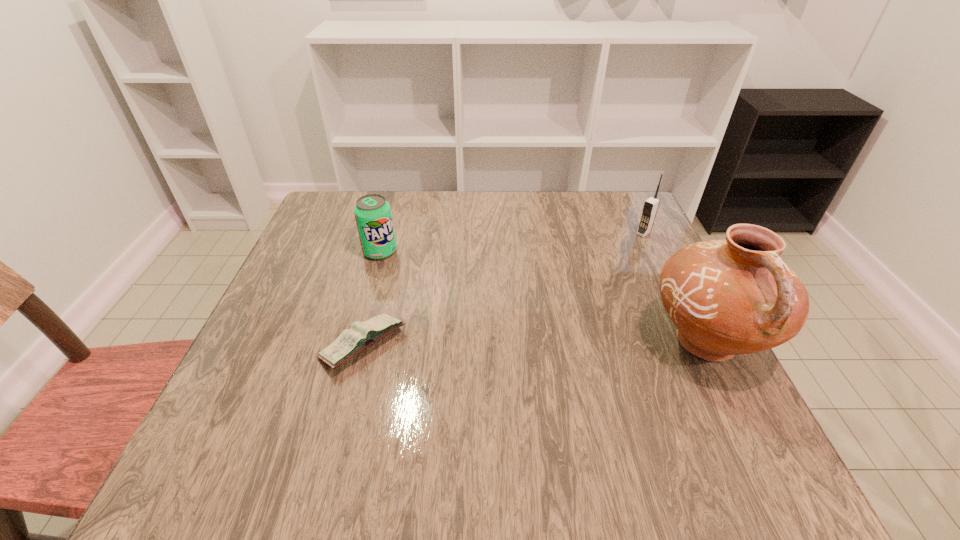
The image size is (960, 540). I want to click on vacant region at the far edge, so click(469, 234).

Where is `vacant area at the near edge`? vacant area at the near edge is located at coordinates (577, 413).

The height and width of the screenshot is (540, 960). In order to click on vacant space at the left edge of the desktop in this screenshot , I will do `click(282, 308)`.

In the image, there is a desktop. Where is `vacant space at the right edge`? The height and width of the screenshot is (540, 960). vacant space at the right edge is located at coordinates (635, 343).

This screenshot has width=960, height=540. I want to click on free space at the far left corner of the desktop, so click(x=315, y=216).

I want to click on empty location between the diary and the pottery, so click(535, 343).

The image size is (960, 540). I want to click on vacant area that lies between the shortest object and the second shortest object, so click(x=372, y=298).

Find the location of a particular element. unoccupied area between the third tallest object and the shortest object is located at coordinates (372, 298).

Identify the location of empty space between the shortest object and the cellular telephone. (503, 289).

Find the location of a particular element. This screenshot has width=960, height=540. vacant space in between the second farthest object and the diary is located at coordinates (372, 298).